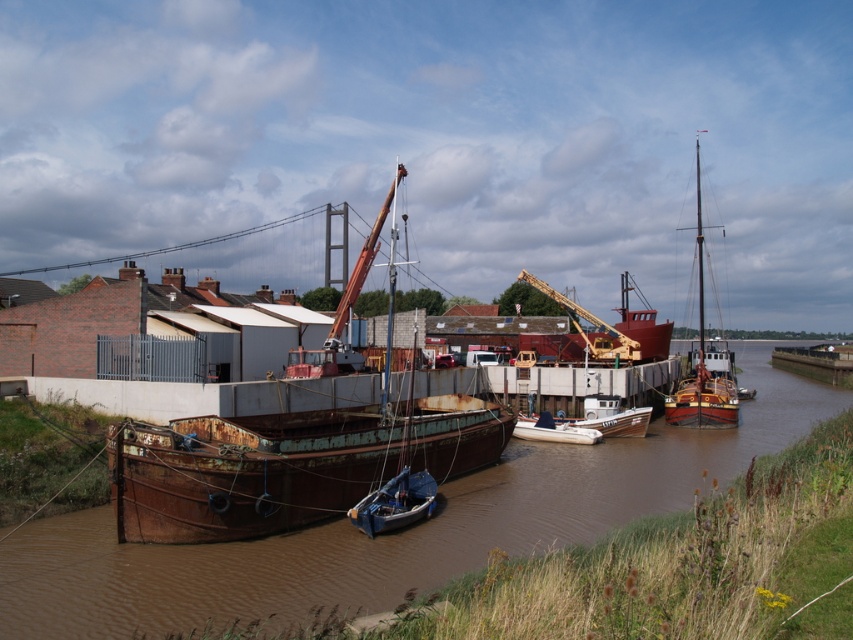
You are standing at the origin point of the dockyard. You need to locate the rusty metal barge at center. According to the coordinates provided, in which direction should you move to reach it?

The rusty metal barge at center is located at point (286, 464), which means it is to the right and slightly forward from your current position at the origin. Move towards the right and forward to reach it.

You are a dock worker who needs to secure a new rope between the brown rusted water at center and the rusty metal barge at center. The rope you have is 40 feet long. Will the rope be long enough?

The brown rusted water at center is 40.20 feet away from the rusty metal barge at center. Since the rope is only 40 feet long, it will be 0.20 feet too short. Therefore, the rope is not long enough.

You are a dock worker who needs to move a white plastic boat at center and a white matte boat at center onto a truck. The truck bed is 2 meters wide. Can both boats fit side by side in the truck bed without overlapping?

The white plastic boat at center is wider than the white matte boat at center. Since the truck bed is 2 meters wide, we need to know the exact widths of both boats to determine if they can fit side by side. However, the provided information only states that the white plastic boat is wider, not by how much. Therefore, it is uncertain if both can fit without overlapping.